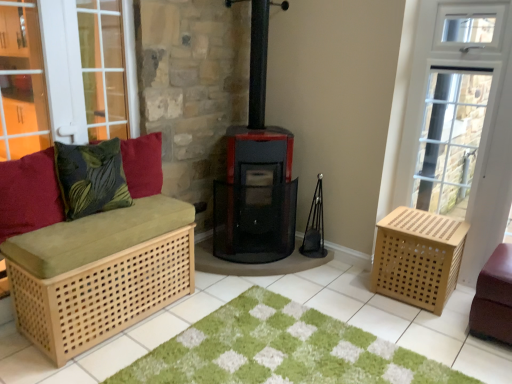
The image size is (512, 384). I want to click on free spot above natural wood crate at right (from a real-world perspective), so click(421, 221).